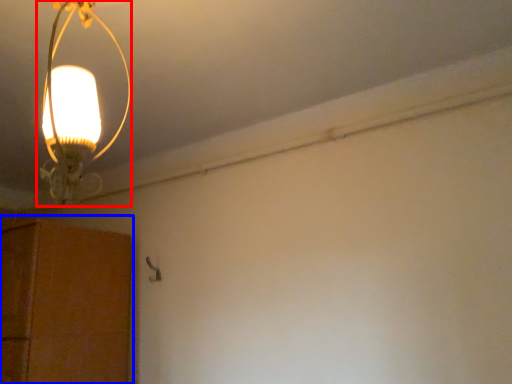
Question: Which object is further to the camera taking this photo, lamp (highlighted by a red box) or cabinetry (highlighted by a blue box)?

Choices:
 (A) lamp
 (B) cabinetry

Answer: (B)